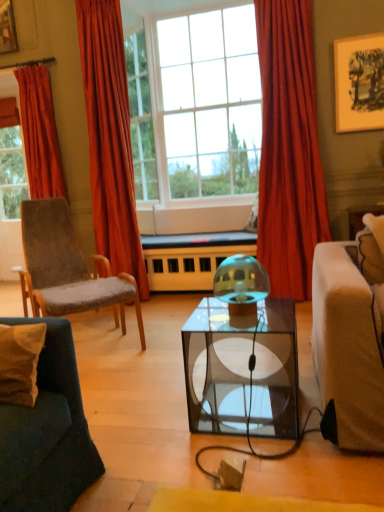
Question: From a real-world perspective, does transparent glass coffee table at center stand above velvet orange curtain at left, the second curtain viewed from the left?

Choices:
 (A) yes
 (B) no

Answer: (B)

Question: Considering the relative sizes of transparent glass coffee table at center and velvet orange curtain at left, the second curtain viewed from the left, in the image provided, is transparent glass coffee table at center smaller than velvet orange curtain at left, the second curtain viewed from the left,?

Choices:
 (A) yes
 (B) no

Answer: (A)

Question: Considering the relative sizes of transparent glass coffee table at center and velvet orange curtain at left, the second curtain viewed from the left, in the image provided, is transparent glass coffee table at center bigger than velvet orange curtain at left, the second curtain viewed from the left,?

Choices:
 (A) yes
 (B) no

Answer: (B)

Question: Are transparent glass coffee table at center and velvet orange curtain at left, which ranks as the 2th curtain in right-to-left order, making contact?

Choices:
 (A) no
 (B) yes

Answer: (A)

Question: Is transparent glass coffee table at center facing towards velvet orange curtain at left, which ranks as the 2th curtain in right-to-left order?

Choices:
 (A) no
 (B) yes

Answer: (A)

Question: Does transparent glass coffee table at center lie in front of velvet orange curtain at left, the second curtain viewed from the left?

Choices:
 (A) no
 (B) yes

Answer: (B)

Question: Does velvet beige pillow at lower left turn towards wooden framed artwork at upper right?

Choices:
 (A) yes
 (B) no

Answer: (B)

Question: Does velvet beige pillow at lower left appear on the right side of wooden framed artwork at upper right?

Choices:
 (A) yes
 (B) no

Answer: (B)

Question: Would you say velvet beige pillow at lower left contains wooden framed artwork at upper right?

Choices:
 (A) yes
 (B) no

Answer: (B)

Question: Can you confirm if velvet beige pillow at lower left is wider than wooden framed artwork at upper right?

Choices:
 (A) no
 (B) yes

Answer: (B)

Question: From the image's perspective, is velvet beige pillow at lower left under wooden framed artwork at upper right?

Choices:
 (A) no
 (B) yes

Answer: (B)

Question: Can you confirm if velvet beige pillow at lower left is positioned to the left of wooden framed artwork at upper right?

Choices:
 (A) yes
 (B) no

Answer: (A)

Question: Is the depth of clear glass window at upper center, placed as the 2th window when sorted from right to left, less than that of velvet grey chair at left?

Choices:
 (A) no
 (B) yes

Answer: (A)